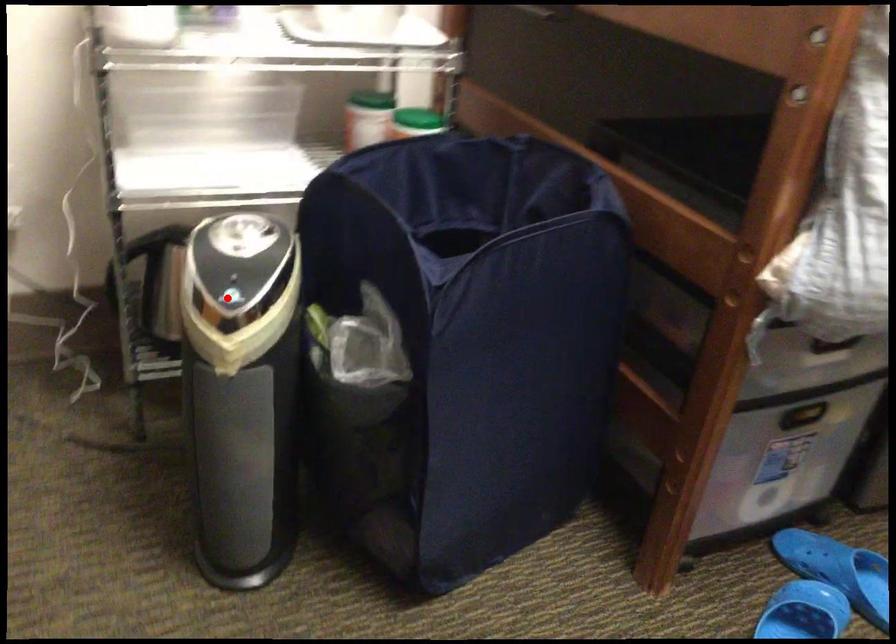
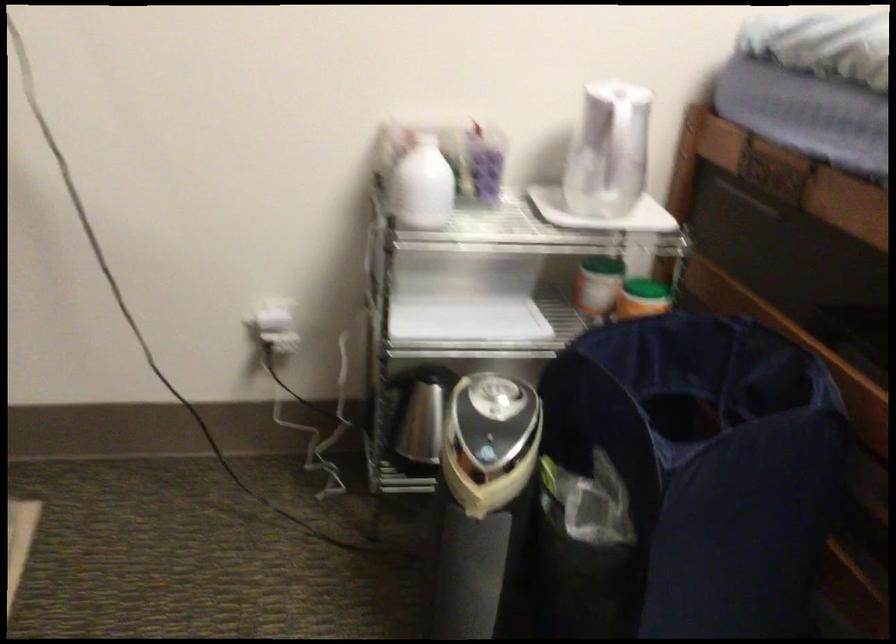
Locate, in the second image, the point that corresponds to the highlighted location in the first image.

(486, 453)